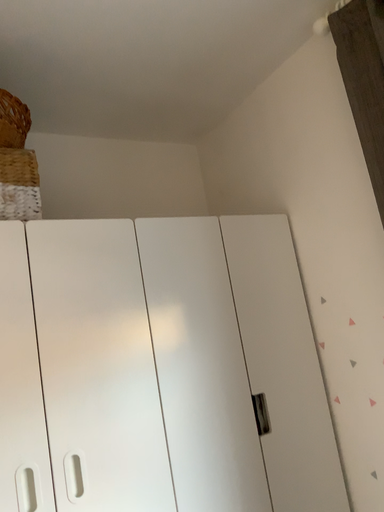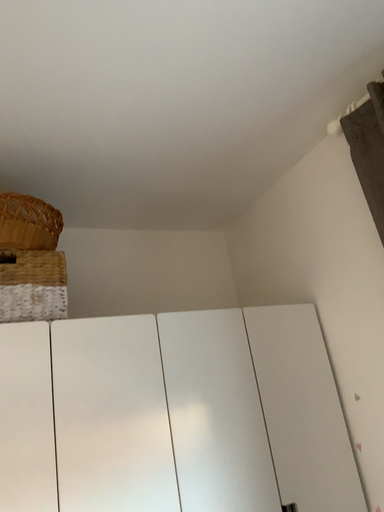
Question: Which way did the camera rotate in the video?

Choices:
 (A) rotated upward
 (B) rotated downward

Answer: (A)